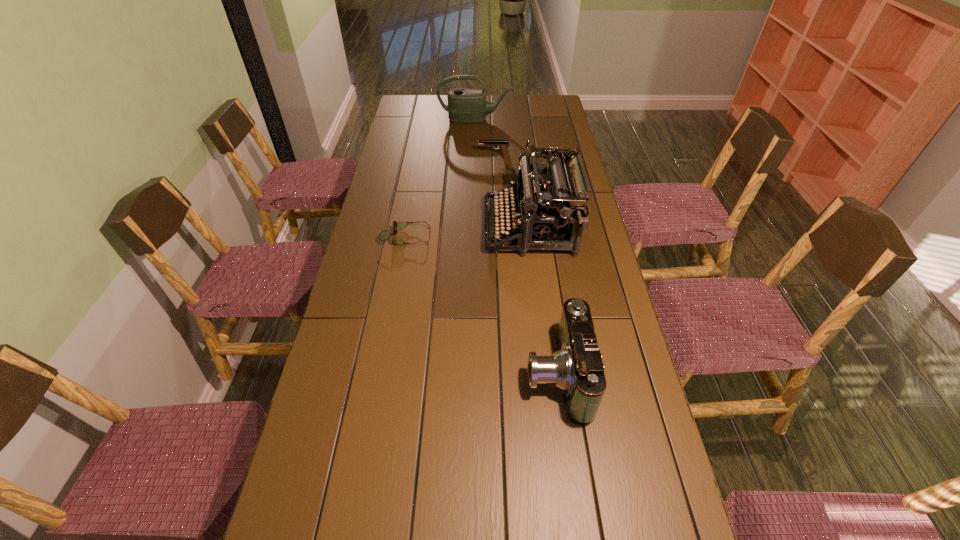
Locate an element on the screen. free space between the watering can and the pistol is located at coordinates (485, 138).

Identify the location of object that ranks as the fourth closest to the spectacles. (464, 105).

Where is `object that stands as the second closest to the farthest object`? The width and height of the screenshot is (960, 540). object that stands as the second closest to the farthest object is located at coordinates (555, 212).